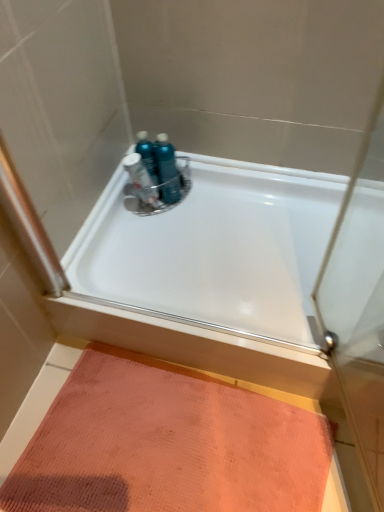
The image size is (384, 512). Identify the location of spots to the right of blue glossy bottles at upper center, the second toiletry positioned from the right. (207, 193).